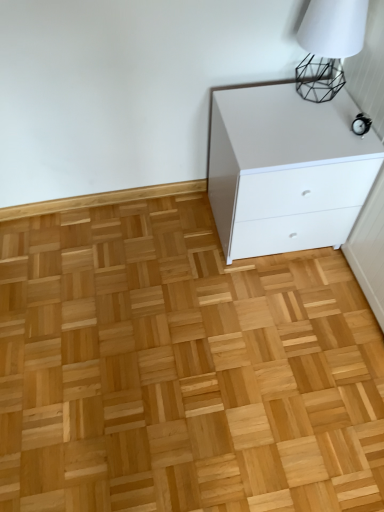
The width and height of the screenshot is (384, 512). I want to click on vacant space situated on the left part of white glossy chest of drawers at upper right, so pos(177,241).